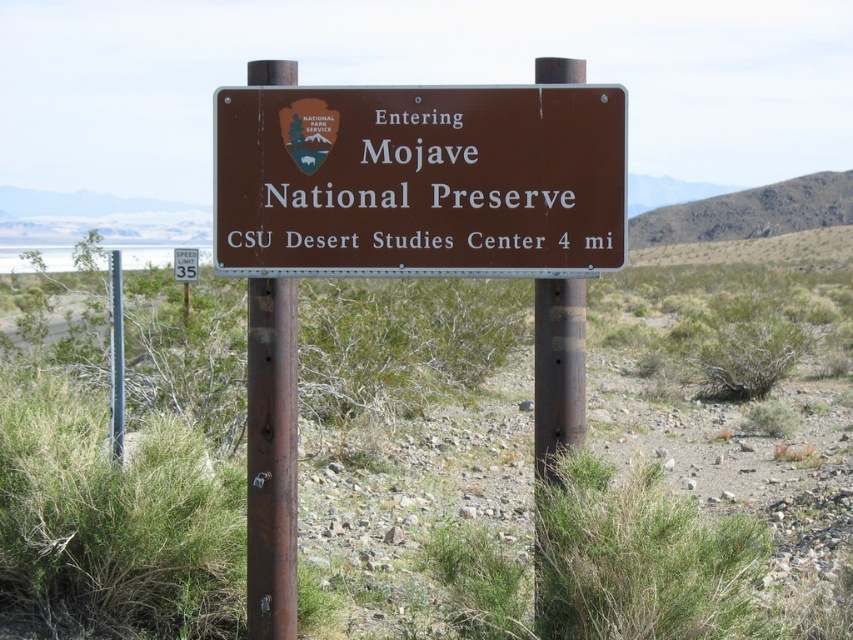
You are standing at the desert signboard and want to reach the CSU Desert Studies Center located 4 miles away. There are two points marked on the signboard. According to their positions, which point should you aim for to head in the correct direction? The two points are point 1 at coordinates (618, 189) and point 2 at coordinates (173, 252).

Point 1 at coordinates (618, 189) is in front of point 2 at coordinates (173, 252), so you should aim for point 1 at coordinates (618, 189) to head in the correct direction.

You are driving through the desert and see the brown metallic sign at center and the white plastic speed limit sign at upper center. Which one is larger?

The white plastic speed limit sign at upper center is larger than the brown metallic sign at center.